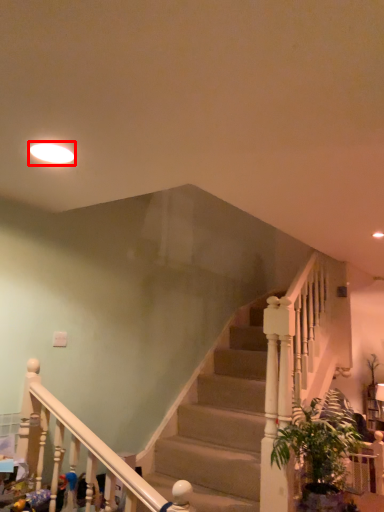
Question: From the image's perspective, what is the correct spatial positioning of lighting (annotated by the red box) in reference to houseplant?

Choices:
 (A) above
 (B) below

Answer: (A)